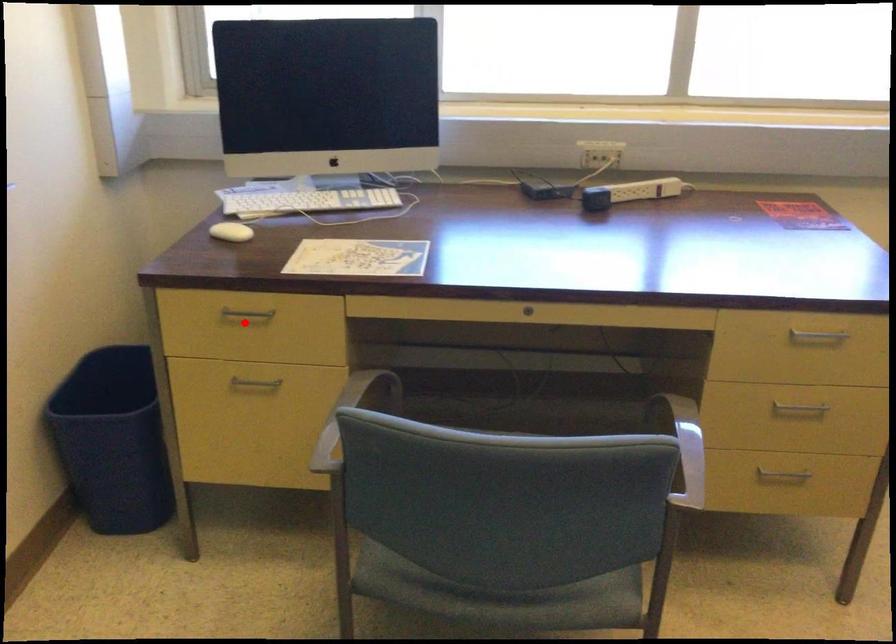
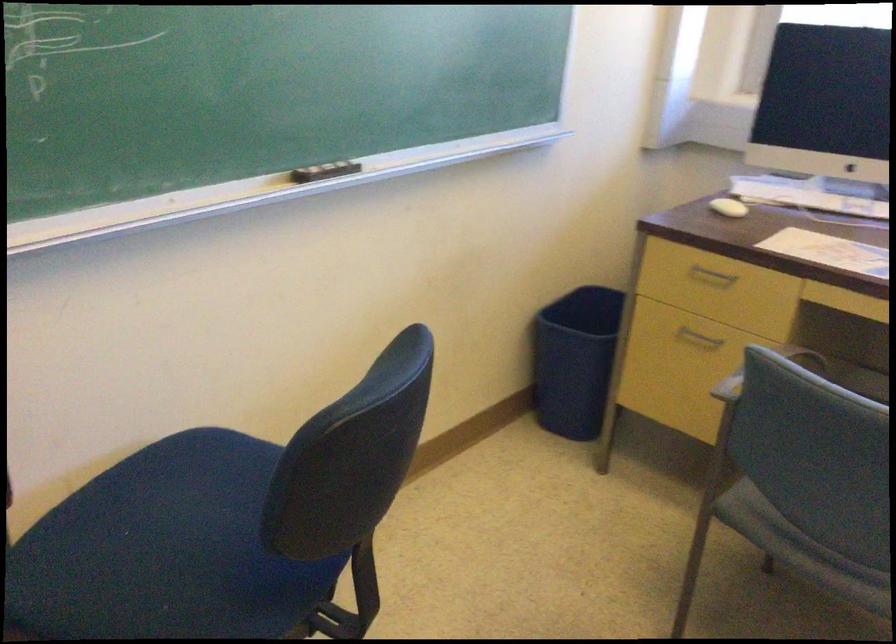
Question: I am providing you with two images of the same scene from different viewpoints. In image1, a red point is highlighted. Considering the same 3D point in image2, which of the following is correct?

Choices:
 (A) It is closer
 (B) It is farther

Answer: (B)